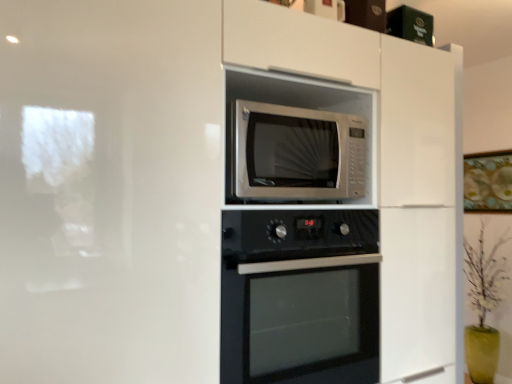
Question: Is silver metallic microwave at center facing towards black glass oven at center?

Choices:
 (A) no
 (B) yes

Answer: (A)

Question: From a real-world perspective, is silver metallic microwave at center beneath black glass oven at center?

Choices:
 (A) no
 (B) yes

Answer: (A)

Question: Is silver metallic microwave at center beside black glass oven at center?

Choices:
 (A) no
 (B) yes

Answer: (A)

Question: Is silver metallic microwave at center at the left side of black glass oven at center?

Choices:
 (A) no
 (B) yes

Answer: (B)

Question: Is silver metallic microwave at center looking in the opposite direction of black glass oven at center?

Choices:
 (A) yes
 (B) no

Answer: (B)

Question: Is silver metallic microwave at center wider than black glass oven at center?

Choices:
 (A) no
 (B) yes

Answer: (A)

Question: From the image's perspective, does white glossy microwave at upper center appear lower than black glass oven at center?

Choices:
 (A) yes
 (B) no

Answer: (B)

Question: Is white glossy microwave at upper center taller than black glass oven at center?

Choices:
 (A) yes
 (B) no

Answer: (A)

Question: From a real-world perspective, is white glossy microwave at upper center on black glass oven at center?

Choices:
 (A) no
 (B) yes

Answer: (B)

Question: Is black glass oven at center a part of white glossy microwave at upper center?

Choices:
 (A) no
 (B) yes

Answer: (B)

Question: Considering the relative positions of white glossy microwave at upper center and black glass oven at center in the image provided, is white glossy microwave at upper center to the left of black glass oven at center from the viewer's perspective?

Choices:
 (A) yes
 (B) no

Answer: (A)

Question: Considering the relative positions of white glossy microwave at upper center and black glass oven at center in the image provided, is white glossy microwave at upper center to the right of black glass oven at center from the viewer's perspective?

Choices:
 (A) yes
 (B) no

Answer: (B)

Question: Can you see black glass oven at center touching silver metallic microwave at center?

Choices:
 (A) yes
 (B) no

Answer: (B)